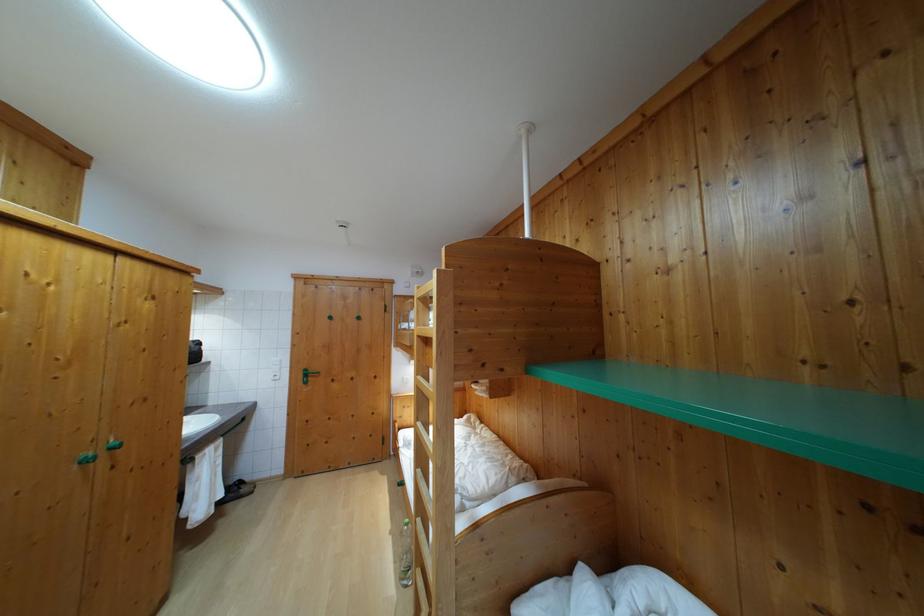
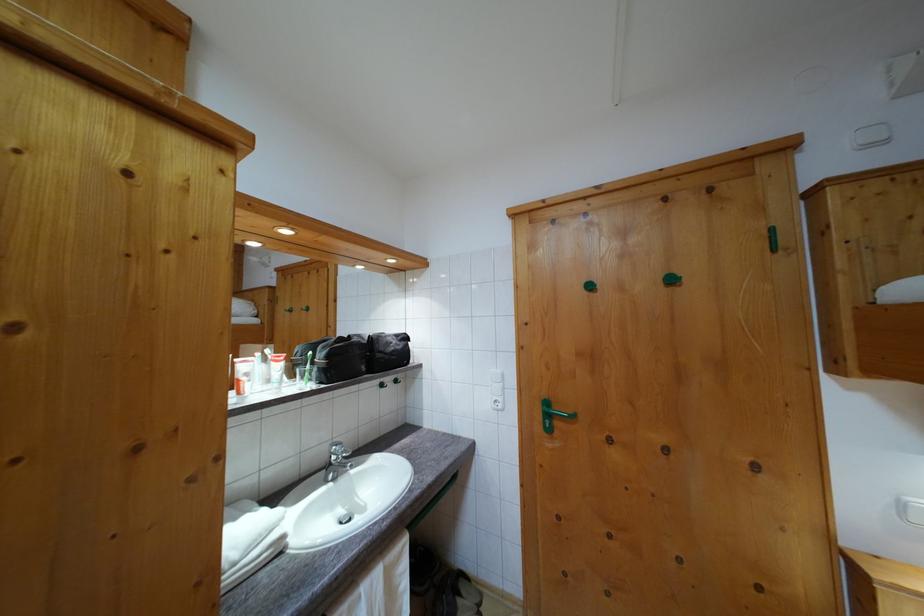
Where in the second image is the point corresponding to point 310,383 from the first image?

(552, 422)